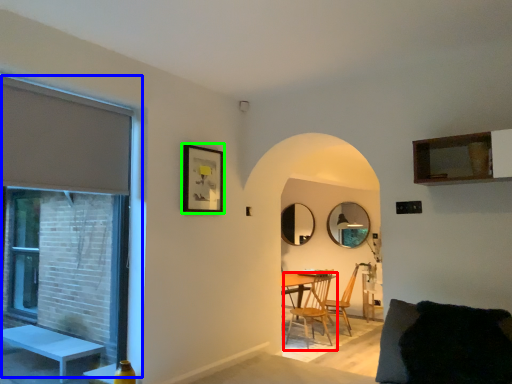
Question: Based on their relative distances, which object is farther from chair (highlighted by a red box)? Choose from window (highlighted by a blue box) and picture frame (highlighted by a green box).

Choices:
 (A) window
 (B) picture frame

Answer: (B)